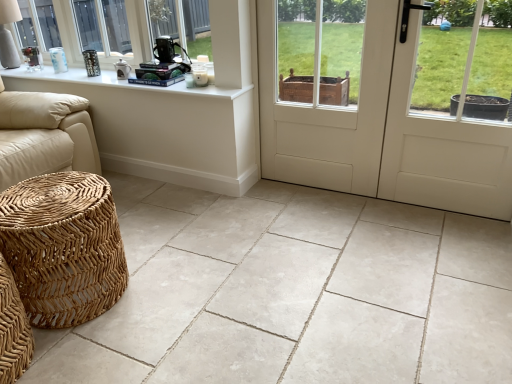
The image size is (512, 384). What are the coordinates of `free space to the left of white wood screen door at center` in the screenshot? It's located at (262, 202).